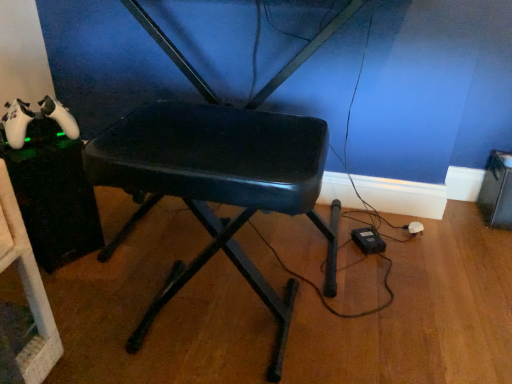
This screenshot has width=512, height=384. In order to click on spots to the right of matte black stool at center in this screenshot , I will do `click(374, 327)`.